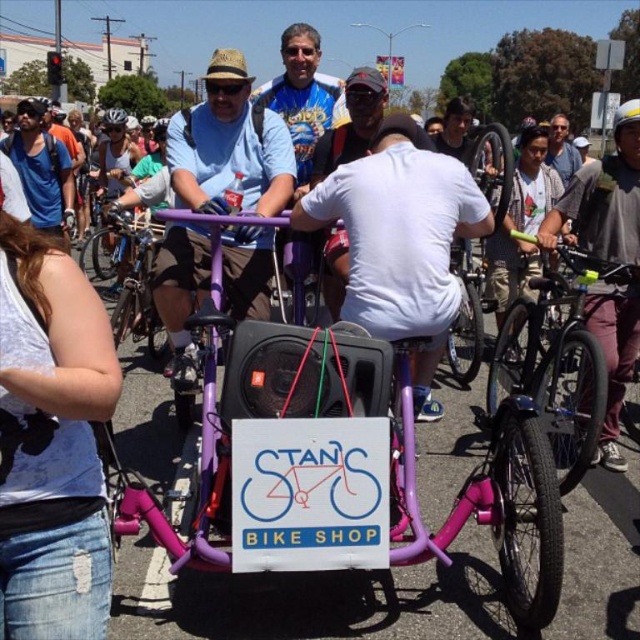
Which is in front, point (208, 193) or point (612, 420)?

Point (208, 193) is in front.

Measure the distance between matte purple bicycle at center and camera.

matte purple bicycle at center is 3.77 meters from camera.

The width and height of the screenshot is (640, 640). Identify the location of matte purple bicycle at center. (228, 147).

Between point (120, 108) and point (152, 120), which one is positioned in front?

Point (152, 120) is in front.

Find the location of a particular element. Image resolution: width=640 pixels, height=640 pixels. matte black helmet at upper left is located at coordinates (115, 116).

Does shiny black bike at center appear on the right side of matte blue shirt at left?

Indeed, shiny black bike at center is positioned on the right side of matte blue shirt at left.

Does shiny black bike at center appear over matte blue shirt at left?

No.

Identify the location of shiny black bike at center. (557, 362).